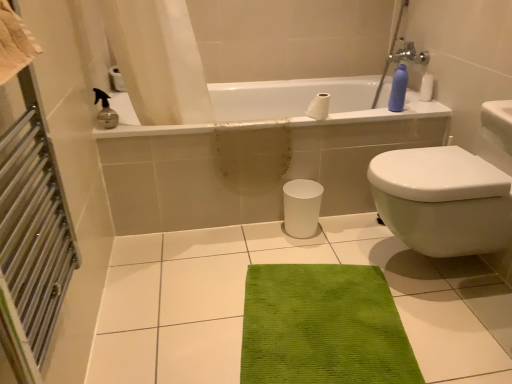
Question: Considering the positions of beige cotton towel at left and white glossy bathtub at upper center in the image, is beige cotton towel at left wider or thinner than white glossy bathtub at upper center?

Choices:
 (A) wide
 (B) thin

Answer: (B)

Question: Looking at the image, does beige cotton towel at left seem bigger or smaller compared to white glossy bathtub at upper center?

Choices:
 (A) small
 (B) big

Answer: (A)

Question: Based on their relative distances, which object is farther from the white glossy bathtub at upper center?

Choices:
 (A) white ceramic tile at center
 (B) white glossy trash can at center
 (C) matte blue plastic bottle at upper right
 (D) brushed metal radiator at left
 (E) white matte toilet paper at upper center

Answer: (D)

Question: Estimate the real-world distances between objects in this image. Which object is farther from the white ceramic tile at center?

Choices:
 (A) white glossy bathtub at upper center
 (B) white glossy trash can at center
 (C) white glossy bidet at right
 (D) brushed metal radiator at left
 (E) white matte toilet paper at upper center

Answer: (E)